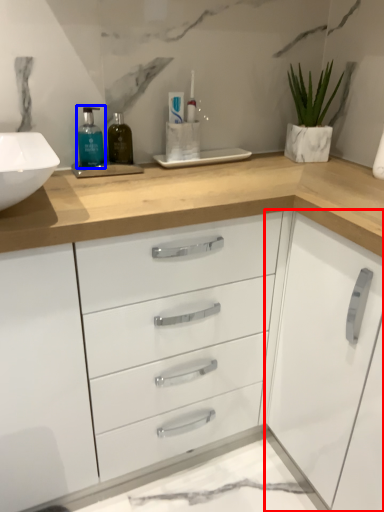
Question: Which object is closer to the camera taking this photo, cabinetry (highlighted by a red box) or mouthwash (highlighted by a blue box)?

Choices:
 (A) cabinetry
 (B) mouthwash

Answer: (A)